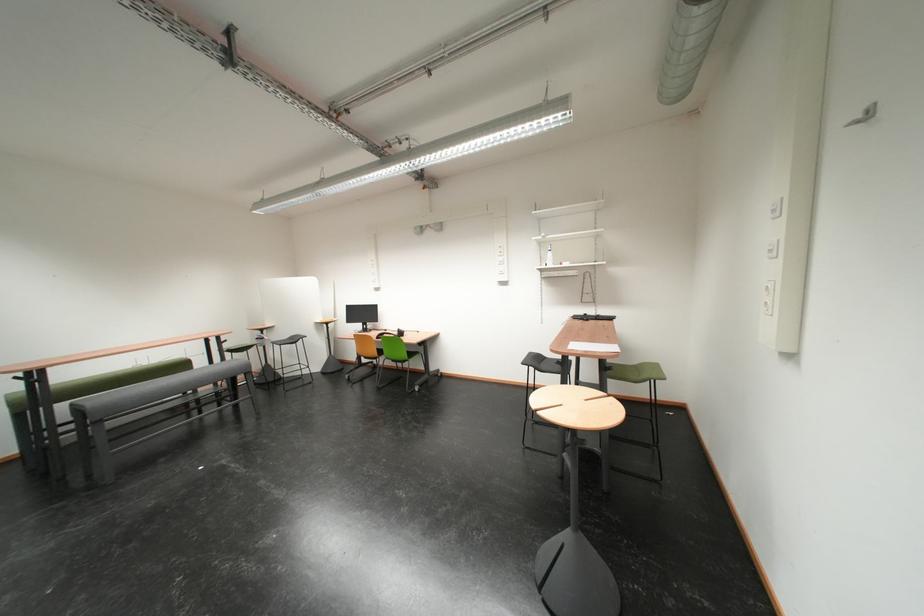
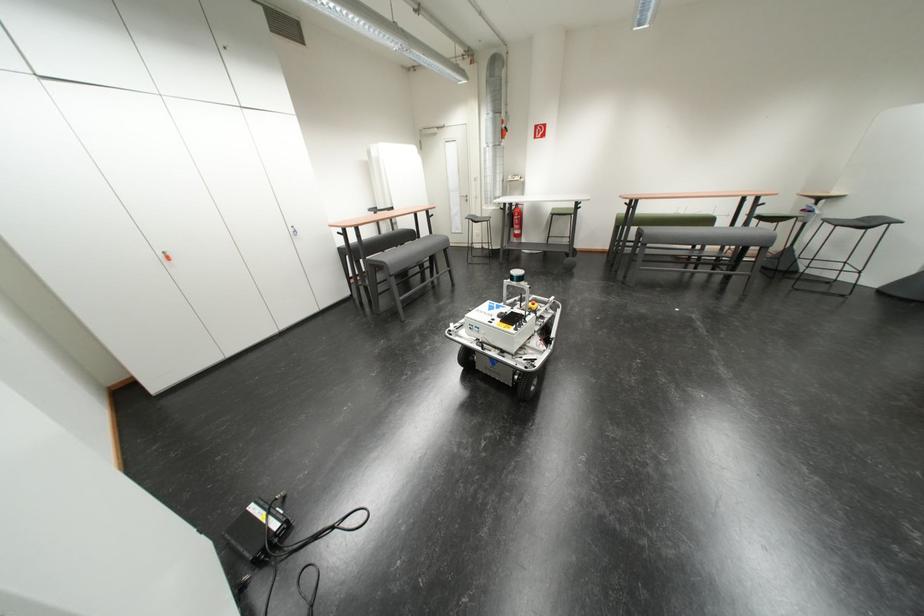
Locate, in the second image, the point that corresponds to (223,363) in the first image.

(744, 228)